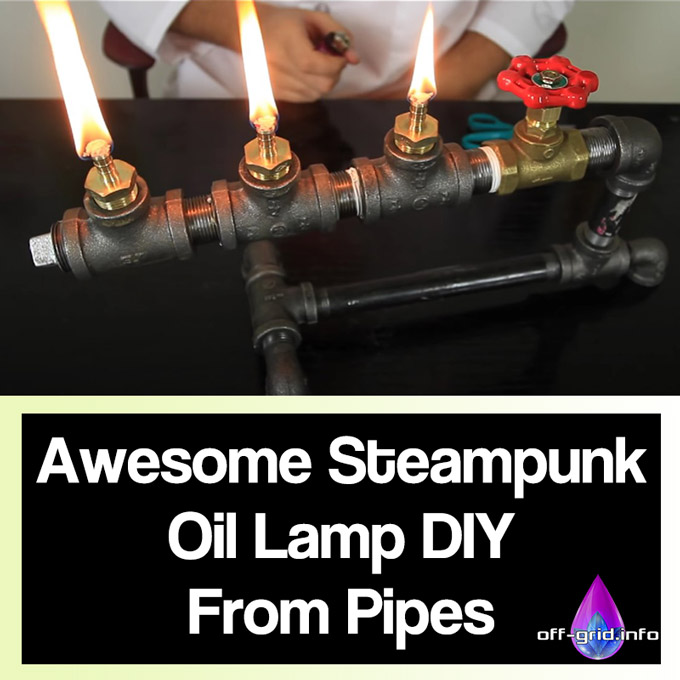
This screenshot has width=680, height=680. Identify the location of chair leg. (141, 92).